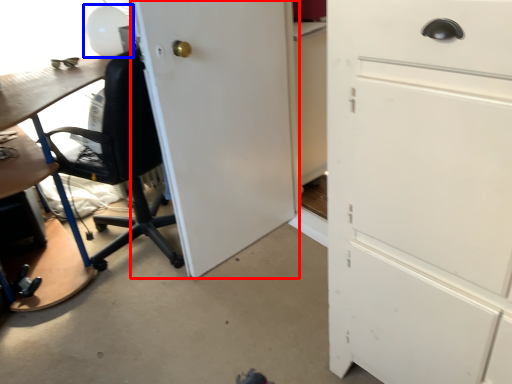
Question: Which object is further to the camera taking this photo, door (highlighted by a red box) or table lamp (highlighted by a blue box)?

Choices:
 (A) door
 (B) table lamp

Answer: (B)